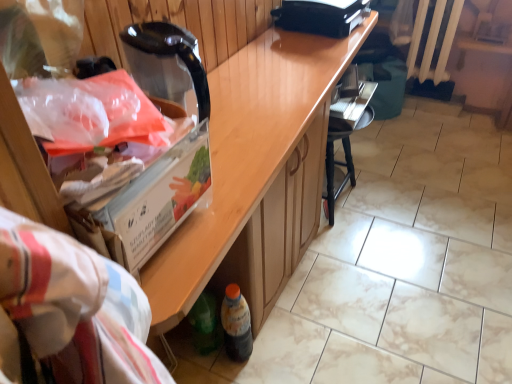
Question: Is white painted metal radiator at upper right bigger than black plastic printer at upper center?

Choices:
 (A) no
 (B) yes

Answer: (B)

Question: From the image's perspective, is white painted metal radiator at upper right below black plastic printer at upper center?

Choices:
 (A) no
 (B) yes

Answer: (A)

Question: From a real-world perspective, is white painted metal radiator at upper right on top of black plastic printer at upper center?

Choices:
 (A) yes
 (B) no

Answer: (B)

Question: Can you confirm if white painted metal radiator at upper right is positioned to the right of black plastic printer at upper center?

Choices:
 (A) yes
 (B) no

Answer: (A)

Question: Is white painted metal radiator at upper right smaller than black plastic printer at upper center?

Choices:
 (A) yes
 (B) no

Answer: (B)

Question: In the image, is black plastic chair at lower center on the left side or the right side of translucent plastic bottle at lower center?

Choices:
 (A) left
 (B) right

Answer: (B)

Question: Considering the positions of black plastic chair at lower center and translucent plastic bottle at lower center in the image, is black plastic chair at lower center wider or thinner than translucent plastic bottle at lower center?

Choices:
 (A) wide
 (B) thin

Answer: (A)

Question: Is point (330, 162) positioned closer to the camera than point (233, 342)?

Choices:
 (A) farther
 (B) closer

Answer: (A)

Question: In terms of size, does black plastic chair at lower center appear bigger or smaller than translucent plastic bottle at lower center?

Choices:
 (A) small
 (B) big

Answer: (B)

Question: From the image's perspective, is wooden cabinet at center located above or below white painted metal radiator at upper right?

Choices:
 (A) above
 (B) below

Answer: (B)

Question: Does point (185, 299) appear closer or farther from the camera than point (425, 59)?

Choices:
 (A) farther
 (B) closer

Answer: (B)

Question: Is wooden cabinet at center inside or outside of white painted metal radiator at upper right?

Choices:
 (A) inside
 (B) outside

Answer: (B)

Question: From a real-world perspective, relative to white painted metal radiator at upper right, is wooden cabinet at center vertically above or below?

Choices:
 (A) above
 (B) below

Answer: (B)

Question: Looking at the image, does wooden cabinet at center seem bigger or smaller compared to black plastic chair at lower center?

Choices:
 (A) small
 (B) big

Answer: (B)

Question: Is wooden cabinet at center spatially inside black plastic chair at lower center, or outside of it?

Choices:
 (A) outside
 (B) inside

Answer: (A)